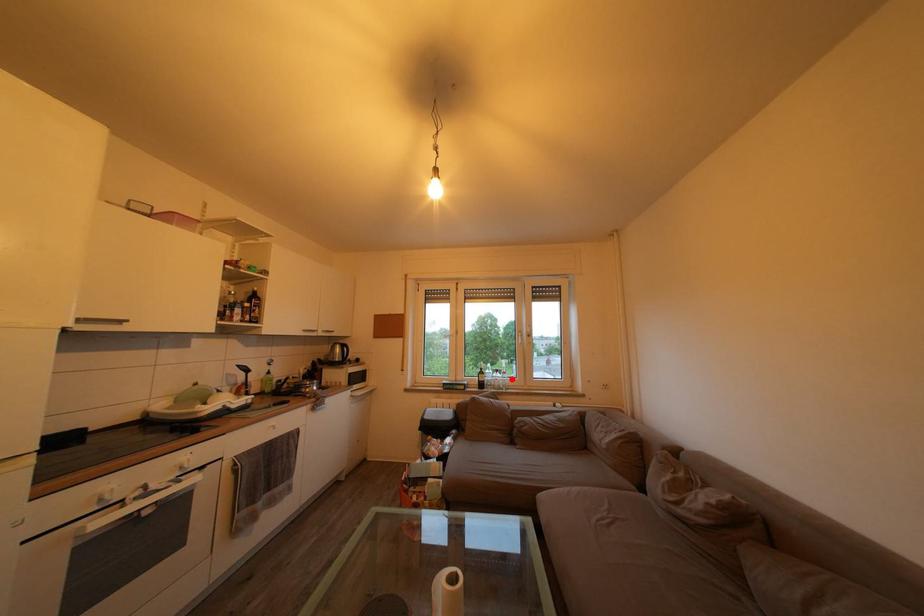
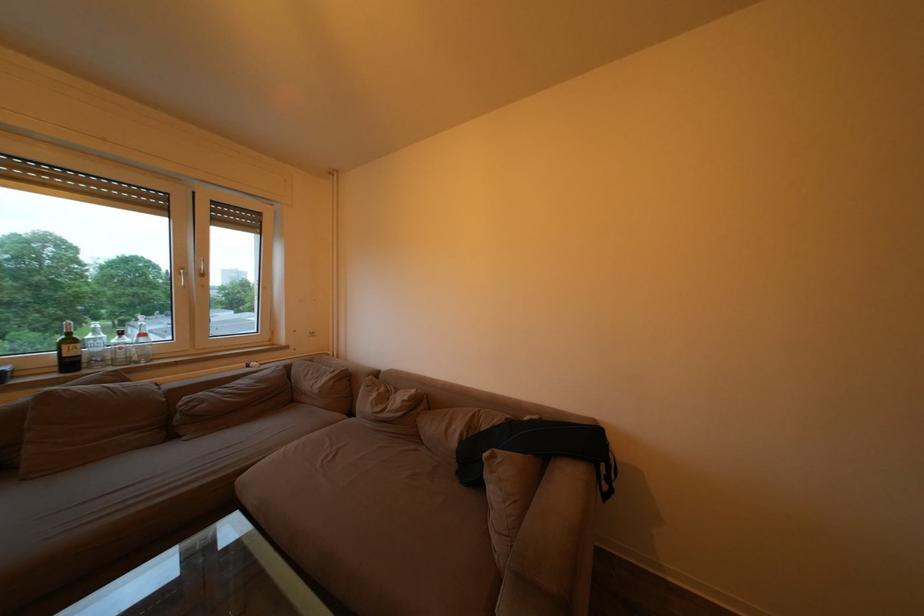
Locate, in the second image, the point that corresponds to the highlighted location in the first image.

(151, 341)